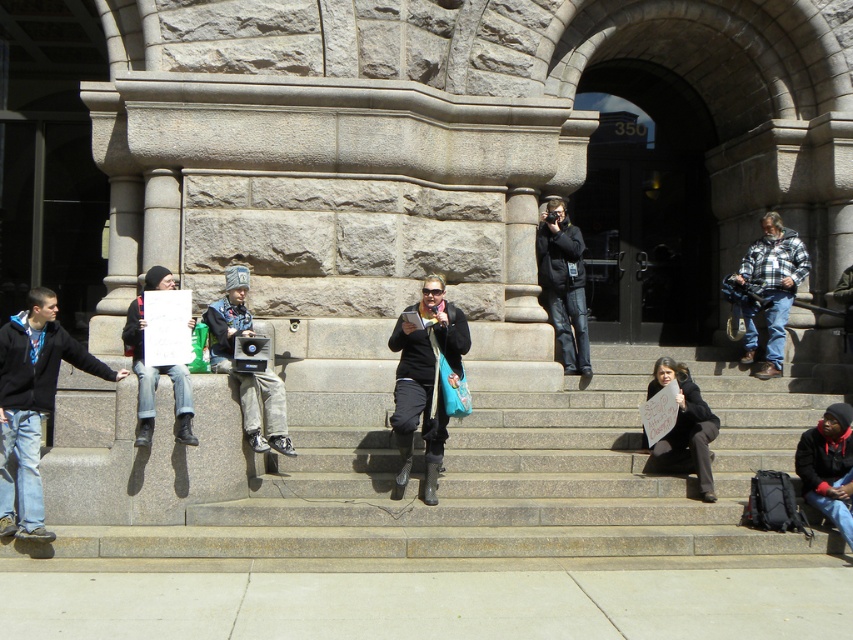
Who is more distant from viewer, (567, 486) or (776, 227)?

The point (776, 227) is more distant.

Which of these two, granite steps at center or plaid flannel shirt at right, stands taller?

plaid flannel shirt at right

Is point (772, 380) more distant than point (775, 268)?

No, (772, 380) is closer to viewer.

Locate an element on the screen. granite steps at center is located at coordinates [x=509, y=480].

Does point (454, 326) come farther from viewer compared to point (577, 364)?

No.

Who is positioned more to the left, black matte jacket at center or black leather jacket at center?

black matte jacket at center

Find the location of `black matte jacket at center`. black matte jacket at center is located at coordinates (424, 380).

How much distance is there between black leather jacket at center and matte black jacket at left?

black leather jacket at center and matte black jacket at left are 4.54 meters apart.

Is black leather jacket at center shorter than matte black jacket at left?

Incorrect, black leather jacket at center's height does not fall short of matte black jacket at left's.

Is point (552, 216) positioned in front of point (144, 444)?

No, it is behind (144, 444).

Find the location of a particular element. This screenshot has width=853, height=640. black leather jacket at center is located at coordinates (563, 284).